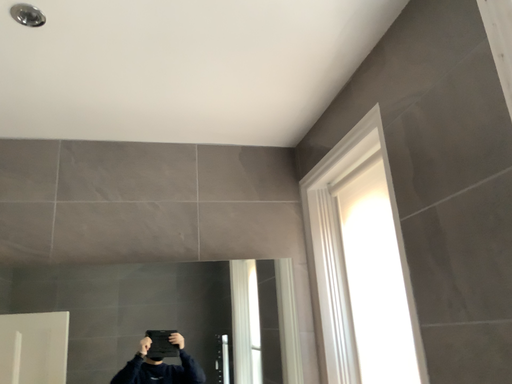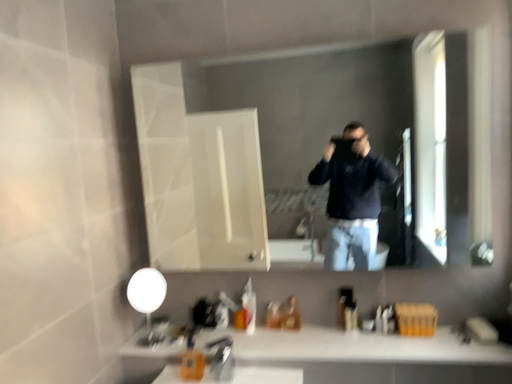
Question: How did the camera likely rotate when shooting the video?

Choices:
 (A) rotated left
 (B) rotated right

Answer: (A)